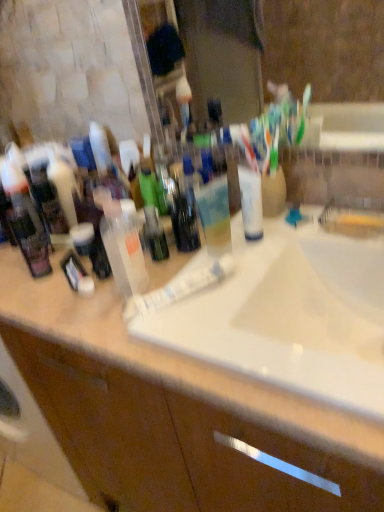
I want to click on blank area to the left of black matte toothbrush at left, the third toiletry when ordered from right to left, so click(26, 286).